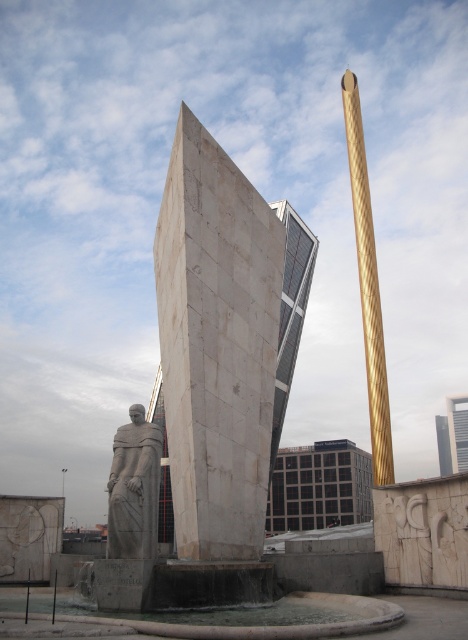
You are a city planner assessing the urban space. You need to determine if the gold textured obelisk at upper right and the gray stone statue at lower left are appropriately sized relative to each other. Based on their sizes, which one should be more prominent in the design?

The gold textured obelisk at upper right is bigger than the gray stone statue at lower left, so it should be the more prominent feature in the design.

You are standing in the urban landscape and want to take a photo of both the gold textured obelisk at upper right and the gray stone statue at lower left. Which direction should you face to have both in your camera frame?

You should face to the left to include both the gold textured obelisk at upper right and the gray stone statue at lower left in your camera frame since the gold textured obelisk at upper right is positioned to the right of the gray stone statue at lower left.